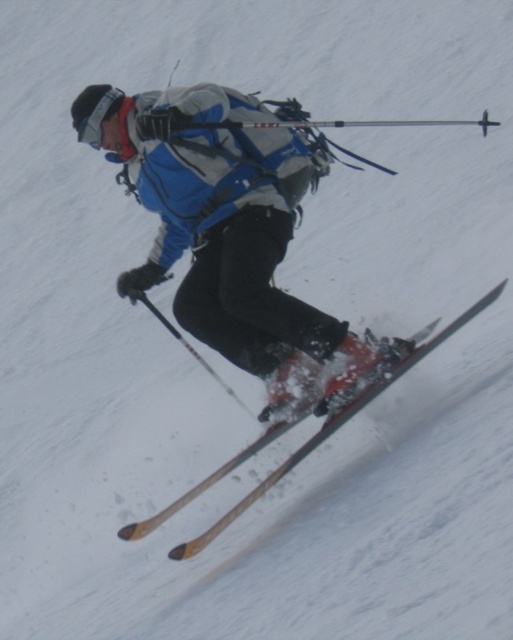
Is yellow wood ski at center above black plastic ski pole at center?

No, yellow wood ski at center is not above black plastic ski pole at center.

Does yellow wood ski at center have a larger size compared to black plastic ski pole at center?

Indeed, yellow wood ski at center has a larger size compared to black plastic ski pole at center.

Is point (152, 518) farther from camera compared to point (170, 332)?

No, it is not.

You are a GUI agent. You are given a task and a screenshot of the screen. Output one action in this format:
    pyautogui.click(x=<x>, y=<y>)
    Task: Click on the yellow wood ski at center
    The width and height of the screenshot is (513, 640).
    Given the screenshot: What is the action you would take?
    pyautogui.click(x=332, y=426)

Is point (280, 340) farther from camera compared to point (209, 372)?

Yes, it is.

Who is higher up, matte blue jacket at center or black plastic ski pole at center?

Positioned higher is matte blue jacket at center.

Is point (305, 388) closer to viewer compared to point (136, 291)?

Yes, it is in front of point (136, 291).

You are a GUI agent. You are given a task and a screenshot of the screen. Output one action in this format:
    pyautogui.click(x=<x>, y=<y>)
    Task: Click on the matte blue jacket at center
    
    Given the screenshot: What is the action you would take?
    pyautogui.click(x=231, y=234)

Between matte blue jacket at center and yellow wood ski at center, which one appears on the left side from the viewer's perspective?

matte blue jacket at center is more to the left.

Which is above, matte blue jacket at center or yellow wood ski at center?

matte blue jacket at center is higher up.

Is point (236, 333) closer to camera compared to point (400, 362)?

No, (236, 333) is behind (400, 362).

Image resolution: width=513 pixels, height=640 pixels. I want to click on matte blue jacket at center, so click(231, 234).